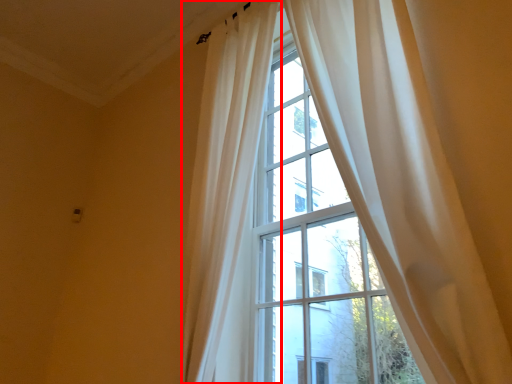
Question: From the image's perspective, what is the correct spatial positioning of curtain (annotated by the red box) in reference to curtain?

Choices:
 (A) above
 (B) below

Answer: (B)